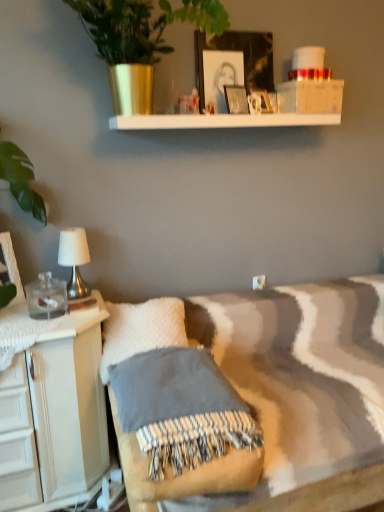
Question: Which direction should I rotate to look at matte white picture frame at upper center, the third picture frame positioned from the bottom?

Choices:
 (A) right
 (B) left

Answer: (A)

Question: Is matte white picture frame at upper center, the third picture frame positioned from the bottom, oriented towards textured wool blanket at center?

Choices:
 (A) no
 (B) yes

Answer: (A)

Question: Considering the relative positions of matte white picture frame at upper center, which ranks as the 4th picture frame in left-to-right order, and textured wool blanket at center in the image provided, is matte white picture frame at upper center, which ranks as the 4th picture frame in left-to-right order, to the right of textured wool blanket at center from the viewer's perspective?

Choices:
 (A) no
 (B) yes

Answer: (B)

Question: Is matte white picture frame at upper center, marked as the 2th picture frame in a top-to-bottom arrangement, completely or partially outside of textured wool blanket at center?

Choices:
 (A) no
 (B) yes

Answer: (B)

Question: Is matte white picture frame at upper center, the third picture frame positioned from the bottom, placed right next to textured wool blanket at center?

Choices:
 (A) yes
 (B) no

Answer: (B)

Question: Is matte white picture frame at upper center, which ranks as the 4th picture frame in left-to-right order, looking in the opposite direction of textured wool blanket at center?

Choices:
 (A) yes
 (B) no

Answer: (B)

Question: Does matte white picture frame at upper center, the third picture frame positioned from the bottom, have a greater height compared to textured wool blanket at center?

Choices:
 (A) no
 (B) yes

Answer: (B)

Question: Considering the relative sizes of white fabric-covered lamp at left and matte white picture frame at upper center, which ranks as the 4th picture frame in left-to-right order, in the image provided, is white fabric-covered lamp at left smaller than matte white picture frame at upper center, which ranks as the 4th picture frame in left-to-right order,?

Choices:
 (A) no
 (B) yes

Answer: (A)

Question: Is white fabric-covered lamp at left wider than matte white picture frame at upper center, marked as the 2th picture frame in a top-to-bottom arrangement?

Choices:
 (A) no
 (B) yes

Answer: (B)

Question: Considering the relative sizes of white fabric-covered lamp at left and matte white picture frame at upper center, marked as the 2th picture frame in a top-to-bottom arrangement, in the image provided, is white fabric-covered lamp at left bigger than matte white picture frame at upper center, marked as the 2th picture frame in a top-to-bottom arrangement,?

Choices:
 (A) no
 (B) yes

Answer: (B)

Question: Does white fabric-covered lamp at left have a lesser width compared to matte white picture frame at upper center, marked as the 2th picture frame in a top-to-bottom arrangement?

Choices:
 (A) no
 (B) yes

Answer: (A)

Question: From the image's perspective, is white fabric-covered lamp at left located beneath matte white picture frame at upper center, positioned as the first picture frame in right-to-left order?

Choices:
 (A) yes
 (B) no

Answer: (A)

Question: From the image's perspective, is white fabric-covered lamp at left located above matte white picture frame at upper center, marked as the 2th picture frame in a top-to-bottom arrangement?

Choices:
 (A) yes
 (B) no

Answer: (B)

Question: Considering the relative sizes of metallic green plant at upper center and matte glass picture frame at upper center, arranged as the third picture frame when viewed from the top, in the image provided, is metallic green plant at upper center thinner than matte glass picture frame at upper center, arranged as the third picture frame when viewed from the top,?

Choices:
 (A) yes
 (B) no

Answer: (B)